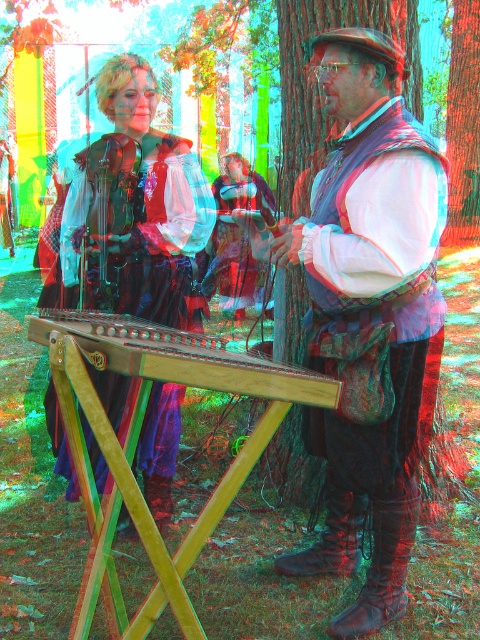
You are a costume designer observing the historical reenactment scene. You need to determine which costume component occupies more visual space in the composition. Based on the provided scene description, which object is larger in size between the matte brown vest at center and the matte black dress at center?

The matte brown vest at center is larger in size compared to the matte black dress at center, so the matte brown vest at center occupies more visual space in the composition.

You are a costume designer preparing for a historical play. You need to place a matte brown vest at center and a matte black dress at center in a display case. The display case has a width of 1 meter. Can both items fit side by side without overlapping?

The matte brown vest at center and matte black dress at center are 98.48 centimeters apart from each other. Since the display case is 1 meter wide, which is 100 centimeters, both items can fit side by side with 1.52 centimeters of space remaining between them.